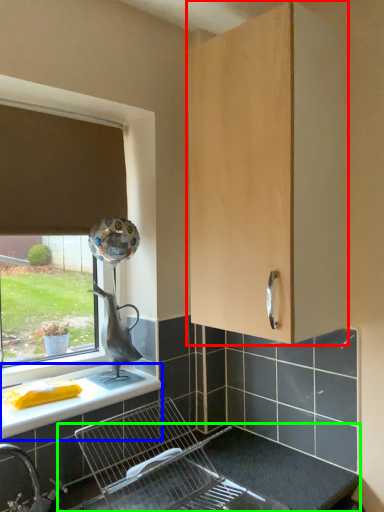
Question: Which object is the farthest from cabinetry (highlighted by a red box)? Choose among these: countertop (highlighted by a blue box) or counter top (highlighted by a green box).

Choices:
 (A) countertop
 (B) counter top

Answer: (A)